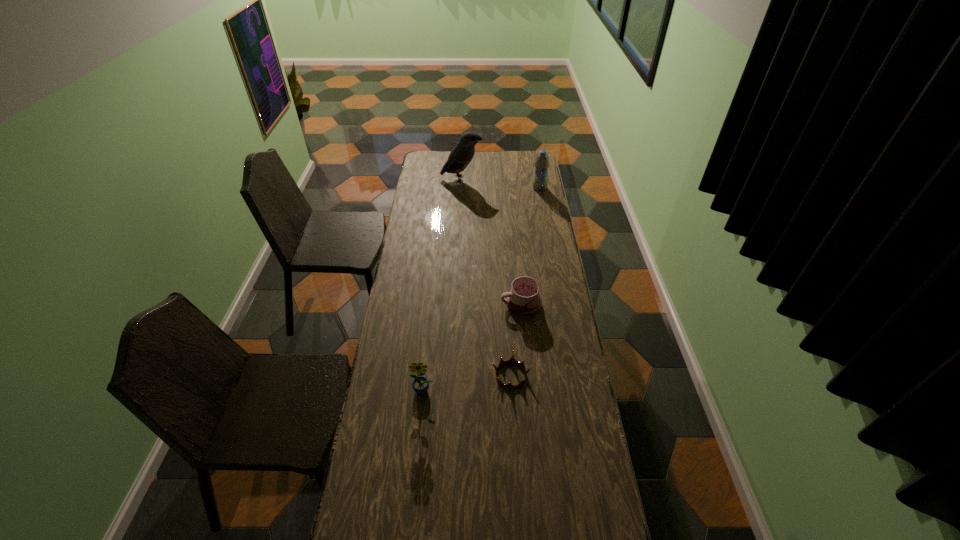
You are a GUI agent. You are given a task and a screenshot of the screen. Output one action in this format:
    pyautogui.click(x=<x>, y=<y>)
    Task: Click on the vacant space that is in between the third shortest object and the parrot
    The image size is (960, 540).
    Given the screenshot: What is the action you would take?
    pyautogui.click(x=443, y=284)

Where is `free space between the third farthest object and the shortest object`? Image resolution: width=960 pixels, height=540 pixels. free space between the third farthest object and the shortest object is located at coordinates (516, 340).

Where is `the second closest object to the mug`? The height and width of the screenshot is (540, 960). the second closest object to the mug is located at coordinates (420, 385).

Locate an element on the screen. the second closest object to the second shortest object is located at coordinates (420, 385).

Locate an element on the screen. free location that satisfies the following two spatial constraints: 1. on the front-facing side of the tallest object; 2. on the right side of the second farthest object is located at coordinates (461, 188).

Where is `free space in the image that satisfies the following two spatial constraints: 1. on the front-facing side of the tallest object; 2. on the right side of the crown`? The image size is (960, 540). free space in the image that satisfies the following two spatial constraints: 1. on the front-facing side of the tallest object; 2. on the right side of the crown is located at coordinates point(450,375).

Find the location of a particular element. The height and width of the screenshot is (540, 960). free location that satisfies the following two spatial constraints: 1. on the front-facing side of the tallest object; 2. on the front-facing side of the third tallest object is located at coordinates (449, 390).

Locate an element on the screen. vacant space that satisfies the following two spatial constraints: 1. on the side with the handle of the fourth tallest object; 2. on the front-facing side of the sunflower is located at coordinates (529, 390).